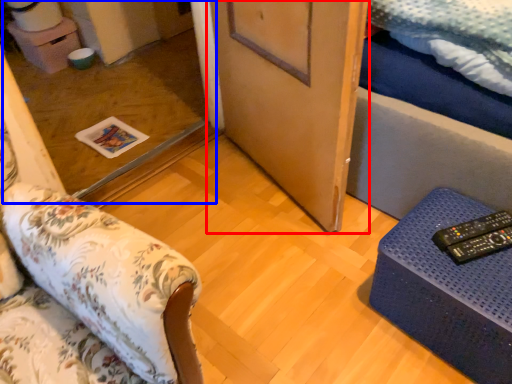
Question: Among these objects, which one is nearest to the camera, door (highlighted by a red box) or glass door (highlighted by a blue box)?

Choices:
 (A) door
 (B) glass door

Answer: (A)